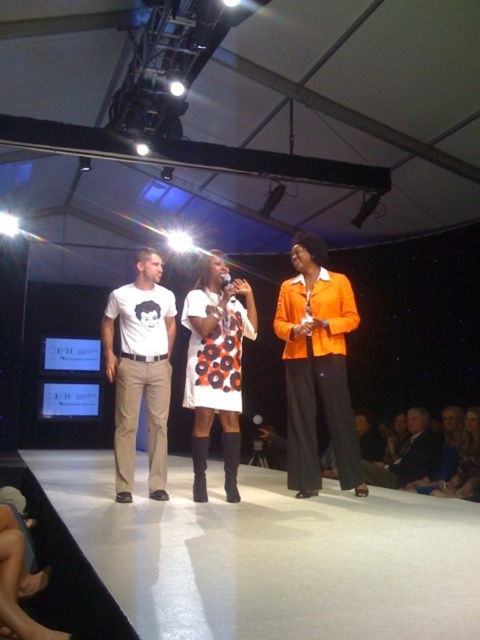
Which of these two, orange matte blazer at center or white matte t-shirt at center, stands taller?

Standing taller between the two is orange matte blazer at center.

Which is in front, point (308, 410) or point (108, 339)?

Point (308, 410) is in front.

Is point (305, 282) positioned after point (136, 269)?

No, (305, 282) is closer to viewer.

At what (x,y) coordinates should I click in order to perform the action: click on orange matte blazer at center. Please return your answer as a coordinate pair (x, y). The image size is (480, 640). Looking at the image, I should click on (316, 368).

How distant is white matte t-shirt at center from white dotted dress at center?

white matte t-shirt at center and white dotted dress at center are 14.28 inches apart.

Is white matte t-shirt at center positioned in front of white dotted dress at center?

Yes, white matte t-shirt at center is in front of white dotted dress at center.

Between point (119, 433) and point (192, 438), which one is positioned in front?

Point (192, 438) is in front.

Image resolution: width=480 pixels, height=640 pixels. Identify the location of white matte t-shirt at center. (141, 371).

Who is shorter, white dotted dress at center or dark gray suit at lower right?

dark gray suit at lower right is shorter.

Does white dotted dress at center appear on the right side of dark gray suit at lower right?

Incorrect, white dotted dress at center is not on the right side of dark gray suit at lower right.

Is point (228, 490) positioned after point (399, 452)?

No.

The width and height of the screenshot is (480, 640). What are the coordinates of `white dotted dress at center` in the screenshot? It's located at (216, 365).